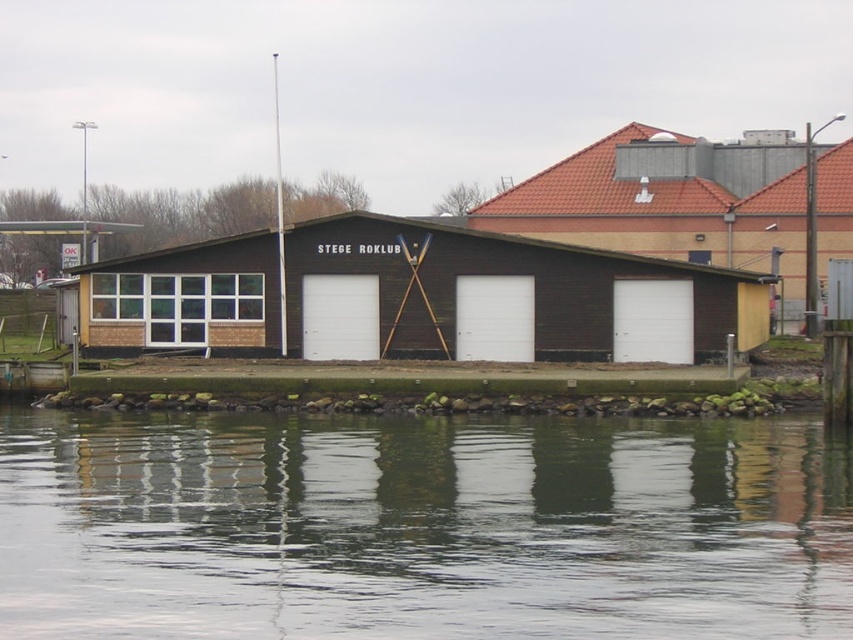
You are standing at the point marked by the coordinates (421, 525) in the image. Based on the scene description, what would you most likely see around you?

You would see transparent water at lower center around you, as the point marks this location.

You are standing on the grassy area in front of the Stege Rowing Club. You want to step onto the brown wooden dock at center from the transparent water at lower center. Is the water level lower than the dock?

The transparent water at lower center has a lesser height compared to brown wooden dock at center, so yes, the water level is lower than the dock.